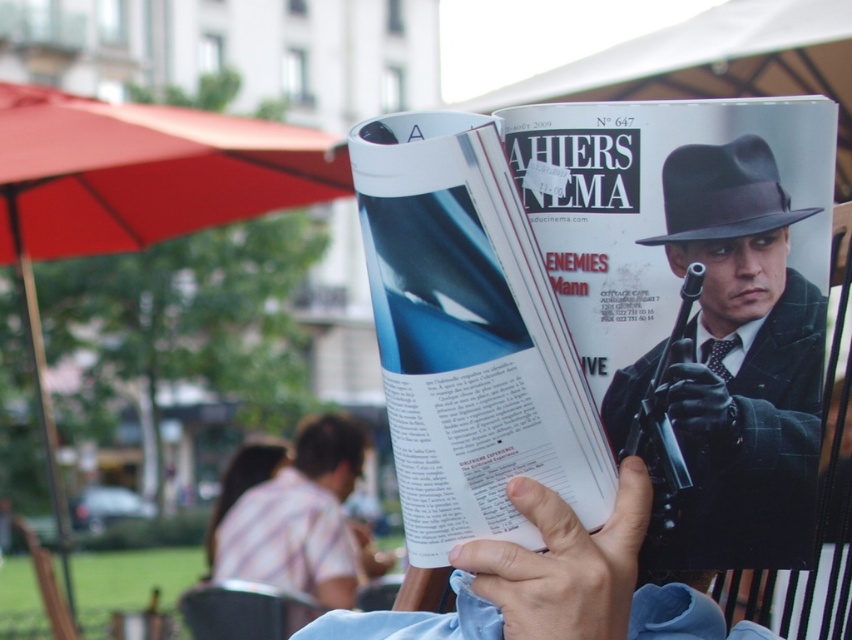
Which is more to the right, white glossy magazine at center or matte black hat at right?

matte black hat at right is more to the right.

Is white glossy magazine at center further to camera compared to matte black hat at right?

No, white glossy magazine at center is closer to the viewer.

Describe the element at coordinates (469, 337) in the screenshot. Image resolution: width=852 pixels, height=640 pixels. I see `white glossy magazine at center` at that location.

Identify the location of white glossy magazine at center. (469, 337).

Is the position of white glossy magazine at center more distant than that of red fabric umbrella at upper left?

No.

Is the position of white glossy magazine at center less distant than that of red fabric umbrella at upper left?

That is True.

Is point (401, 428) behind point (85, 179)?

No, (401, 428) is closer to viewer.

Where is `white glossy magazine at center`? The image size is (852, 640). white glossy magazine at center is located at coordinates (469, 337).

From the picture: Can you confirm if matte black hat at right is taller than red fabric umbrella at upper left?

Incorrect, matte black hat at right's height is not larger of red fabric umbrella at upper left's.

Does point (732, 518) come closer to viewer compared to point (311, 148)?

Yes.

Between point (793, 192) and point (124, 248), which one is positioned behind?

Positioned behind is point (124, 248).

Where is `matte black hat at right`? The image size is (852, 640). matte black hat at right is located at coordinates coord(741,365).